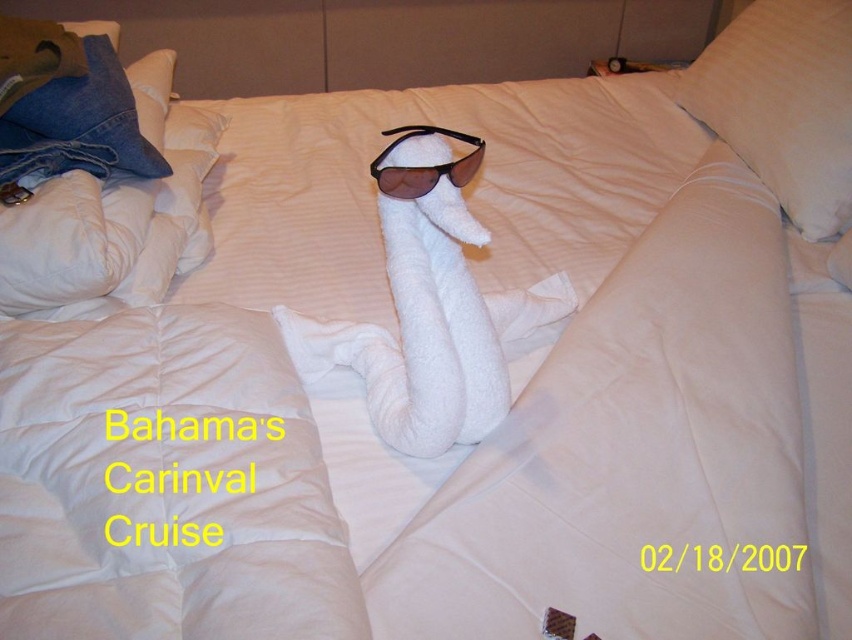
Question: Which object is closer to the camera taking this photo?

Choices:
 (A) denim fabric pillow at upper left
 (B) white soft pillow at upper right

Answer: (A)

Question: Based on their relative distances, which object is nearer to the denim fabric pillow at upper left?

Choices:
 (A) white soft pillow at upper right
 (B) dark brown plastic sunglasses at center

Answer: (B)

Question: Does white soft pillow at upper right have a smaller size compared to denim fabric pillow at upper left?

Choices:
 (A) yes
 (B) no

Answer: (B)

Question: Which object appears closest to the camera in this image?

Choices:
 (A) white soft pillow at upper right
 (B) denim fabric pillow at upper left
 (C) dark brown plastic sunglasses at center

Answer: (C)

Question: Is denim fabric pillow at upper left behind dark brown plastic sunglasses at center?

Choices:
 (A) yes
 (B) no

Answer: (A)

Question: In this image, where is white soft pillow at upper right located relative to denim fabric pillow at upper left?

Choices:
 (A) above
 (B) below

Answer: (A)